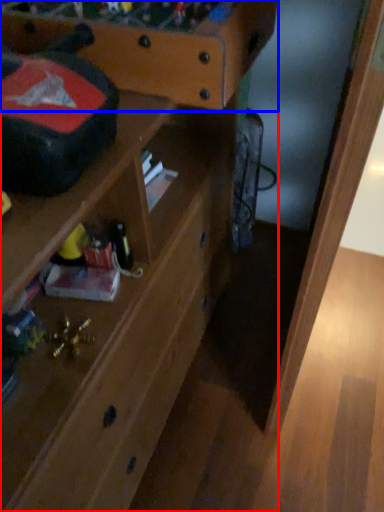
Question: Which object is closer to the camera taking this photo, shelf (highlighted by a red box) or writing desk (highlighted by a blue box)?

Choices:
 (A) shelf
 (B) writing desk

Answer: (A)